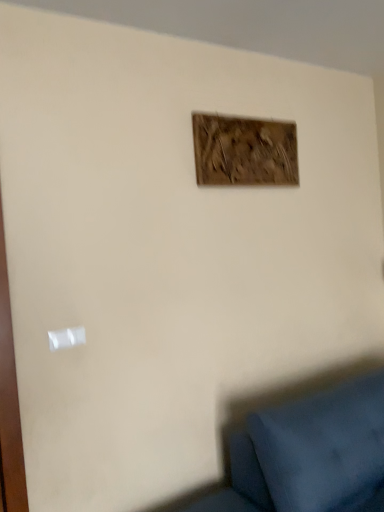
Question: Is wooden frame at upper center outside of white plastic light switch at lower left?

Choices:
 (A) no
 (B) yes

Answer: (B)

Question: Is the surface of wooden frame at upper center in direct contact with white plastic light switch at lower left?

Choices:
 (A) yes
 (B) no

Answer: (B)

Question: Can you confirm if wooden frame at upper center is positioned to the right of white plastic light switch at lower left?

Choices:
 (A) no
 (B) yes

Answer: (B)

Question: Does wooden frame at upper center contain white plastic light switch at lower left?

Choices:
 (A) yes
 (B) no

Answer: (B)

Question: From a real-world perspective, does wooden frame at upper center stand above white plastic light switch at lower left?

Choices:
 (A) no
 (B) yes

Answer: (B)

Question: From the image's perspective, is wooden frame at upper center under white plastic light switch at lower left?

Choices:
 (A) no
 (B) yes

Answer: (A)

Question: Is the depth of white plastic light switch at lower left less than that of wooden frame at upper center?

Choices:
 (A) yes
 (B) no

Answer: (A)

Question: Is white plastic light switch at lower left surrounding wooden frame at upper center?

Choices:
 (A) yes
 (B) no

Answer: (B)

Question: Are white plastic light switch at lower left and wooden frame at upper center far apart?

Choices:
 (A) yes
 (B) no

Answer: (A)

Question: From a real-world perspective, is white plastic light switch at lower left located beneath wooden frame at upper center?

Choices:
 (A) yes
 (B) no

Answer: (A)

Question: From the image's perspective, is white plastic light switch at lower left located above wooden frame at upper center?

Choices:
 (A) yes
 (B) no

Answer: (B)

Question: Is white plastic light switch at lower left not within wooden frame at upper center?

Choices:
 (A) no
 (B) yes

Answer: (B)

Question: Considering the positions of point (284, 164) and point (59, 332), is point (284, 164) closer or farther from the camera than point (59, 332)?

Choices:
 (A) closer
 (B) farther

Answer: (B)